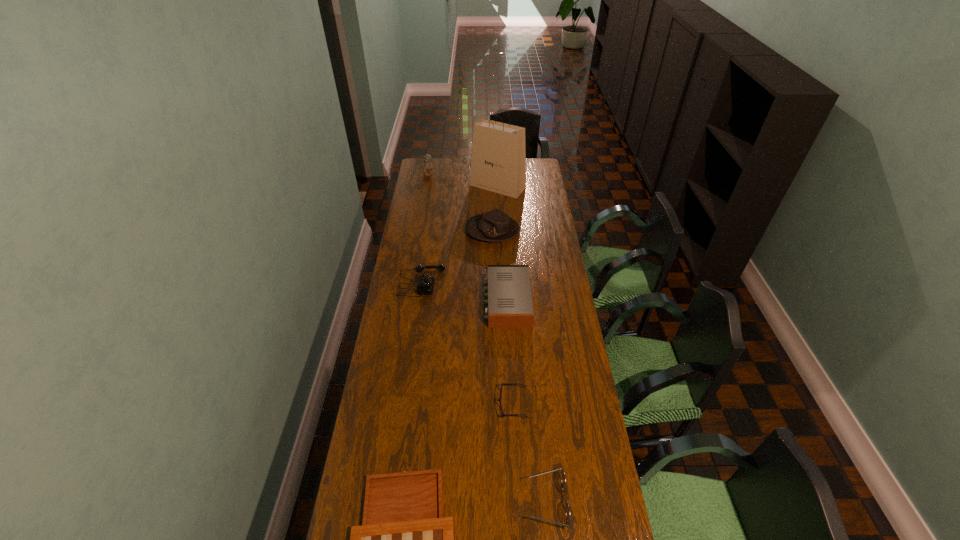
The height and width of the screenshot is (540, 960). I want to click on the tallest object, so click(x=498, y=164).

Find the location of a particular element. The width and height of the screenshot is (960, 540). teddy bear is located at coordinates (426, 166).

What are the coordinates of `hat` in the screenshot? It's located at (494, 226).

At what (x,y) coordinates should I click in order to perform the action: click on the third farthest object. Please return your answer as a coordinate pair (x, y). Looking at the image, I should click on (494, 226).

Locate an element on the screen. Image resolution: width=960 pixels, height=540 pixels. telephone is located at coordinates (425, 285).

Identify the location of radio receiver. (510, 305).

This screenshot has height=540, width=960. I want to click on the nearer spectacles, so click(x=568, y=515).

Locate an element on the screen. The height and width of the screenshot is (540, 960). the taller spectacles is located at coordinates (568, 515).

You are a GUI agent. You are given a task and a screenshot of the screen. Output one action in this format:
    pyautogui.click(x=<x>, y=<y>)
    Task: Click on the shorter spectacles
    
    Given the screenshot: What is the action you would take?
    pyautogui.click(x=499, y=399)

Image resolution: width=960 pixels, height=540 pixels. Find the location of `the seventh tallest object`. the seventh tallest object is located at coordinates (499, 399).